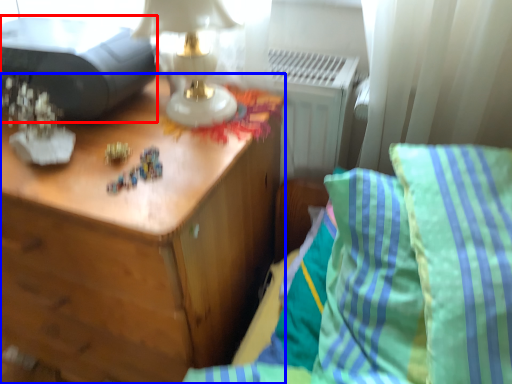
Question: Which object is closer to the camera taking this photo, printer (highlighted by a red box) or nightstand (highlighted by a blue box)?

Choices:
 (A) printer
 (B) nightstand

Answer: (B)